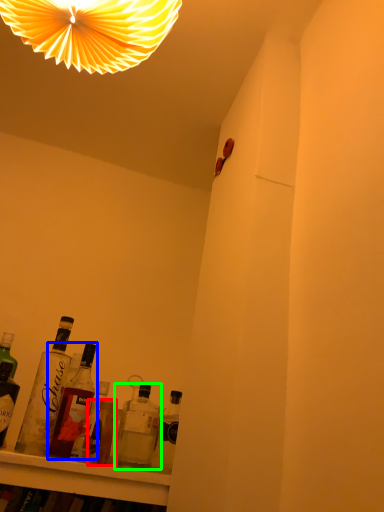
Question: Considering the real-world distances, which object is farthest from bottle (highlighted by a red box)? bottle (highlighted by a blue box) or bottle (highlighted by a green box)?

Choices:
 (A) bottle
 (B) bottle

Answer: (A)